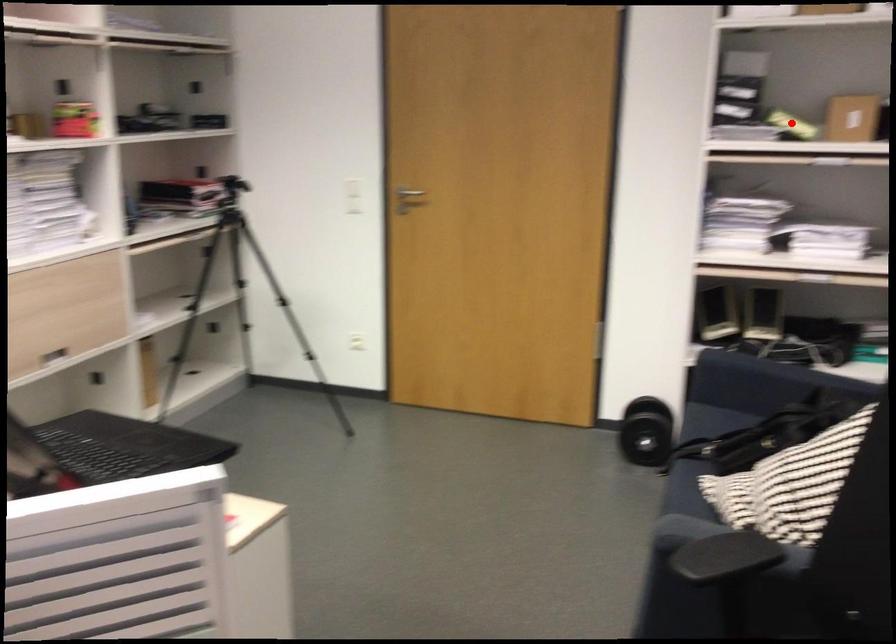
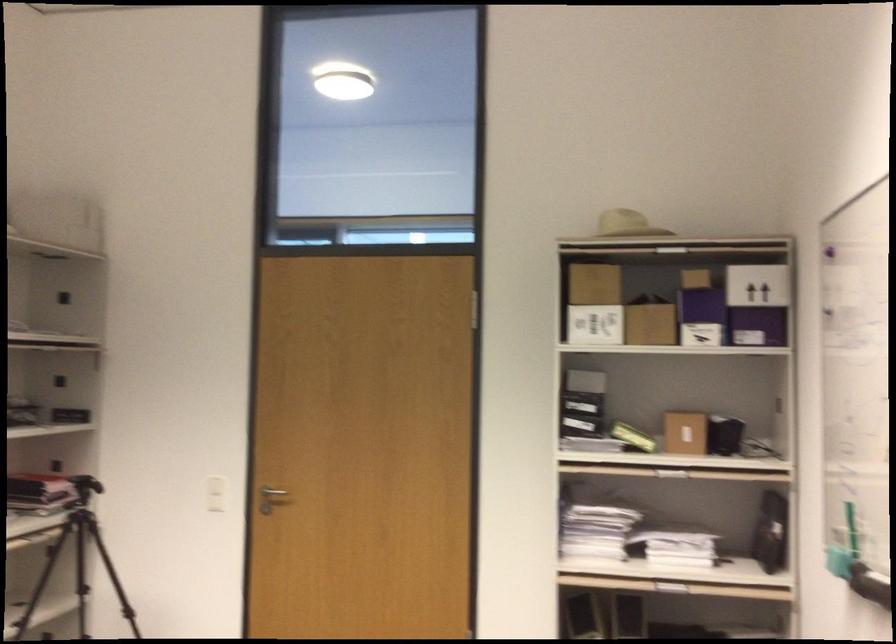
Locate, in the second image, the point that corresponds to the highlighted location in the first image.

(633, 437)